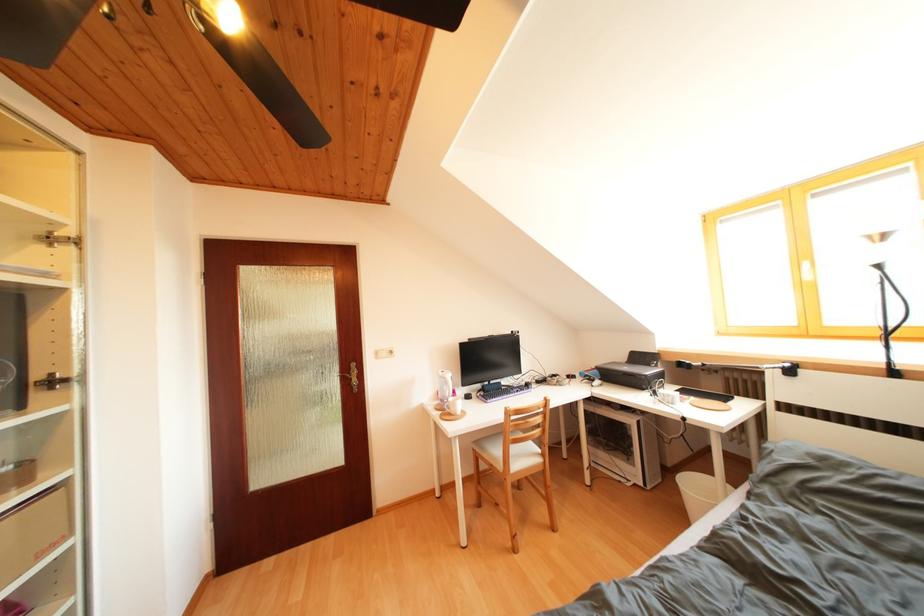
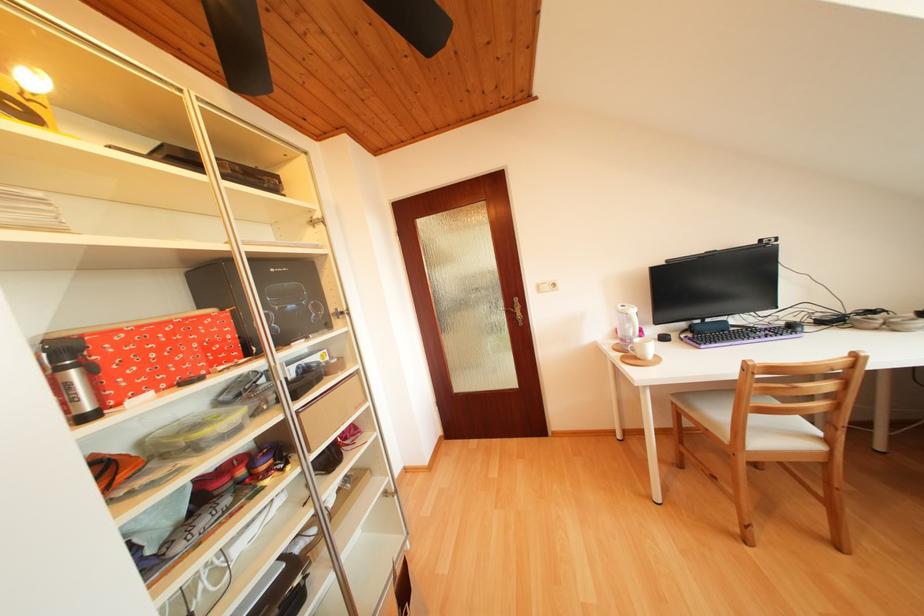
Question: Based on the continuous images, in which direction is the camera rotating? Reply with the corresponding letter.

Choices:
 (A) Left
 (B) Right
 (C) Up
 (D) Down

Answer: (A)